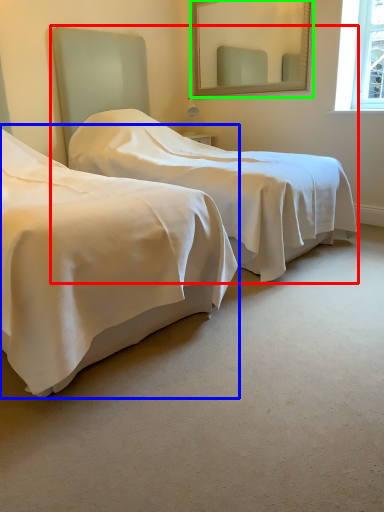
Question: Estimate the real-world distances between objects in this image. Which object is farther from bed (highlighted by a red box), bed (highlighted by a blue box) or mirror (highlighted by a green box)?

Choices:
 (A) bed
 (B) mirror

Answer: (B)